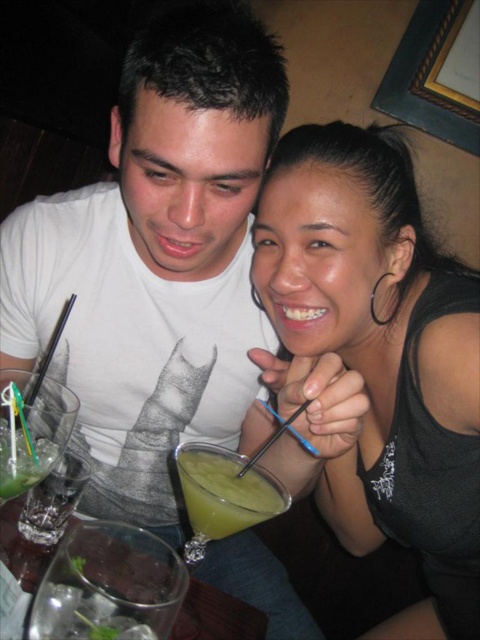
Does clear glass at lower left appear on the right side of green translucent glass at left?

Yes, clear glass at lower left is to the right of green translucent glass at left.

Is clear glass at lower left taller than green translucent glass at left?

No.

Does point (58, 602) come closer to viewer compared to point (70, 410)?

Yes.

Find the location of a particular element. This screenshot has width=480, height=640. clear glass at lower left is located at coordinates (108, 582).

From the picture: Which of these two, green smoothie at center or green translucent glass at left, stands taller?

green translucent glass at left

Does green smoothie at center appear on the left side of green translucent glass at left?

Incorrect, green smoothie at center is not on the left side of green translucent glass at left.

Is point (191, 520) positioned after point (0, 403)?

Yes, it is behind point (0, 403).

The height and width of the screenshot is (640, 480). Find the location of `green smoothie at center`. green smoothie at center is located at coordinates (225, 492).

Is clear glass at lower left below green smoothie at center?

Yes.

Looking at this image, is clear glass at lower left taller than green smoothie at center?

Incorrect, clear glass at lower left's height is not larger of green smoothie at center's.

This screenshot has height=640, width=480. I want to click on clear glass at lower left, so 108,582.